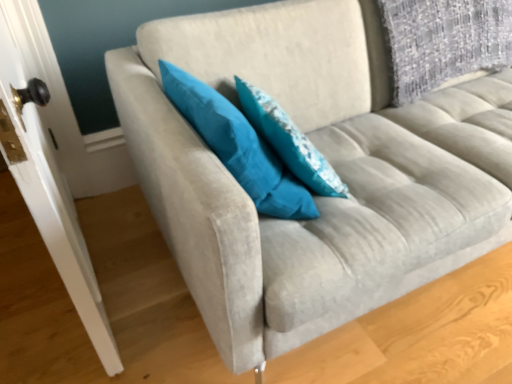
Question: In which direction should I rotate to look at teal fabric pillow at center, the 2th pillow viewed from the left?

Choices:
 (A) right
 (B) left

Answer: (A)

Question: Considering the relative sizes of teal fabric pillow at center, the 2th pillow viewed from the left, and teal fabric pillow at center, placed as the second pillow when sorted from right to left, in the image provided, is teal fabric pillow at center, the 2th pillow viewed from the left, thinner than teal fabric pillow at center, placed as the second pillow when sorted from right to left,?

Choices:
 (A) yes
 (B) no

Answer: (A)

Question: Considering the relative sizes of teal fabric pillow at center, the 2th pillow viewed from the left, and teal fabric pillow at center, placed as the second pillow when sorted from right to left, in the image provided, is teal fabric pillow at center, the 2th pillow viewed from the left, shorter than teal fabric pillow at center, placed as the second pillow when sorted from right to left,?

Choices:
 (A) yes
 (B) no

Answer: (A)

Question: Is teal fabric pillow at center, the 2th pillow viewed from the left, taller than teal fabric pillow at center, placed as the second pillow when sorted from right to left?

Choices:
 (A) no
 (B) yes

Answer: (A)

Question: Are teal fabric pillow at center, the 2th pillow viewed from the left, and teal fabric pillow at center, the 1th pillow in the left-to-right sequence, located far from each other?

Choices:
 (A) no
 (B) yes

Answer: (A)

Question: Considering the relative positions of teal fabric pillow at center, the 2th pillow viewed from the left, and teal fabric pillow at center, placed as the second pillow when sorted from right to left, in the image provided, is teal fabric pillow at center, the 2th pillow viewed from the left, in front of teal fabric pillow at center, placed as the second pillow when sorted from right to left,?

Choices:
 (A) no
 (B) yes

Answer: (A)

Question: Could you tell me if teal fabric pillow at center, the 2th pillow viewed from the left, is facing teal fabric pillow at center, the 1th pillow in the left-to-right sequence?

Choices:
 (A) yes
 (B) no

Answer: (B)

Question: From the image's perspective, is teal fabric pillow at center, which is the first pillow from right to left, under white glossy door handle at left?

Choices:
 (A) yes
 (B) no

Answer: (B)

Question: Is teal fabric pillow at center, which is the first pillow from right to left, thinner than white glossy door handle at left?

Choices:
 (A) yes
 (B) no

Answer: (B)

Question: Does teal fabric pillow at center, which is the first pillow from right to left, contain white glossy door handle at left?

Choices:
 (A) yes
 (B) no

Answer: (B)

Question: Considering the relative sizes of teal fabric pillow at center, the 2th pillow viewed from the left, and white glossy door handle at left in the image provided, is teal fabric pillow at center, the 2th pillow viewed from the left, smaller than white glossy door handle at left?

Choices:
 (A) yes
 (B) no

Answer: (A)

Question: Is teal fabric pillow at center, the 2th pillow viewed from the left, shorter than white glossy door handle at left?

Choices:
 (A) no
 (B) yes

Answer: (B)

Question: Considering the relative positions of teal fabric pillow at center, which is the first pillow from right to left, and white glossy door handle at left in the image provided, is teal fabric pillow at center, which is the first pillow from right to left, behind white glossy door handle at left?

Choices:
 (A) no
 (B) yes

Answer: (B)

Question: Is white glossy door handle at left positioned in front of teal fabric pillow at center, the 2th pillow viewed from the left?

Choices:
 (A) yes
 (B) no

Answer: (A)